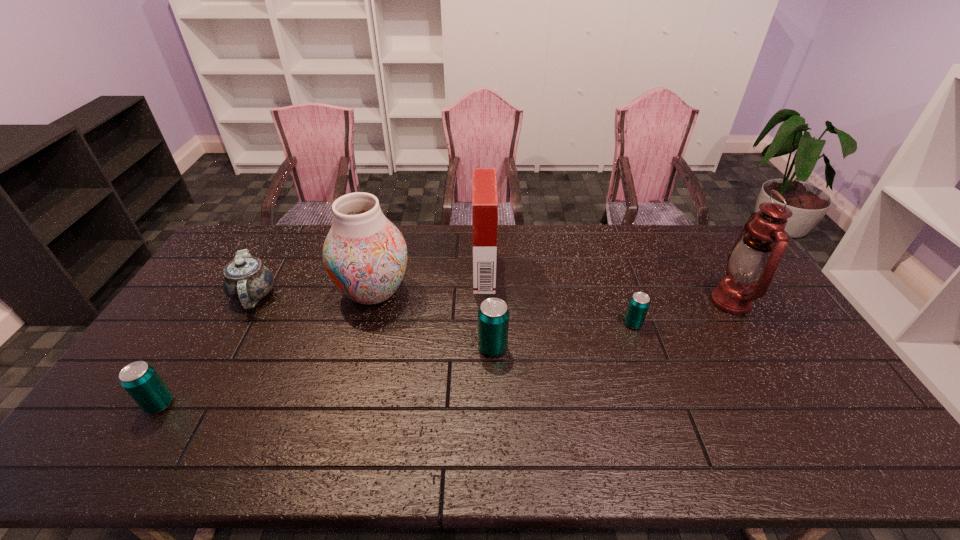
Identify which beer can is the second nearest to the chinaware. Please provide its 2D coordinates. Your answer should be formatted as a tuple, i.e. [(x, y)], where the tuple contains the x and y coordinates of a point satisfying the conditions above.

[(493, 315)]

The width and height of the screenshot is (960, 540). Identify the location of the closest beer can to the cigarette_case. (493, 315).

Where is `free space that satisfies the following two spatial constraints: 1. on the back side of the shortest beer can; 2. on the front-facing side of the cigarette_case`? This screenshot has width=960, height=540. free space that satisfies the following two spatial constraints: 1. on the back side of the shortest beer can; 2. on the front-facing side of the cigarette_case is located at coordinates (614, 272).

This screenshot has width=960, height=540. I want to click on vacant space that satisfies the following two spatial constraints: 1. on the front-facing side of the cigarette_case; 2. from the spout of the chinaware, so click(x=485, y=295).

Identify the location of vacant space that satisfies the following two spatial constraints: 1. from the spout of the shortest object; 2. on the right side of the chinaware. Image resolution: width=960 pixels, height=540 pixels. (238, 324).

You are a GUI agent. You are given a task and a screenshot of the screen. Output one action in this format:
    pyautogui.click(x=<x>, y=<y>)
    Task: Click on the vacant region that satisfies the following two spatial constraints: 1. on the front-facing side of the cigarette_case; 2. on the back side of the oil lamp
    The height and width of the screenshot is (540, 960).
    Given the screenshot: What is the action you would take?
    pyautogui.click(x=485, y=302)

Where is `vacant position in the image that satisfies the following two spatial constraints: 1. on the front-facing side of the cigarette_case; 2. from the spout of the chinaware`? vacant position in the image that satisfies the following two spatial constraints: 1. on the front-facing side of the cigarette_case; 2. from the spout of the chinaware is located at coordinates (485, 295).